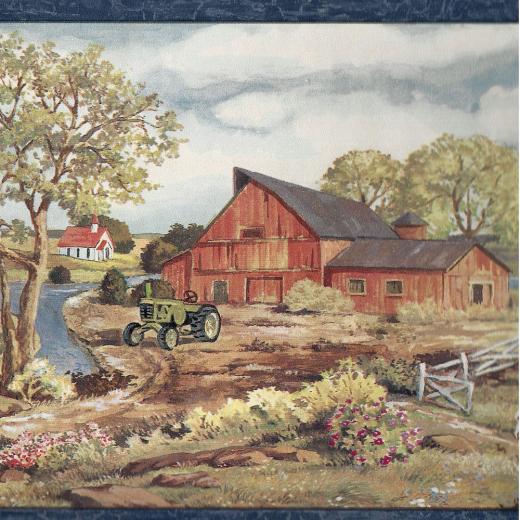
The image size is (520, 520). I want to click on artwork, so click(x=280, y=362).